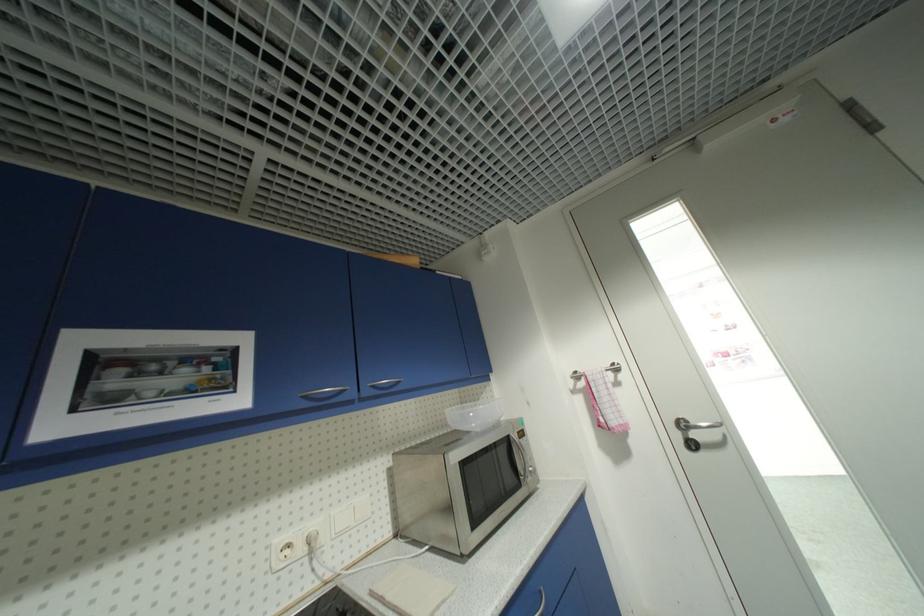
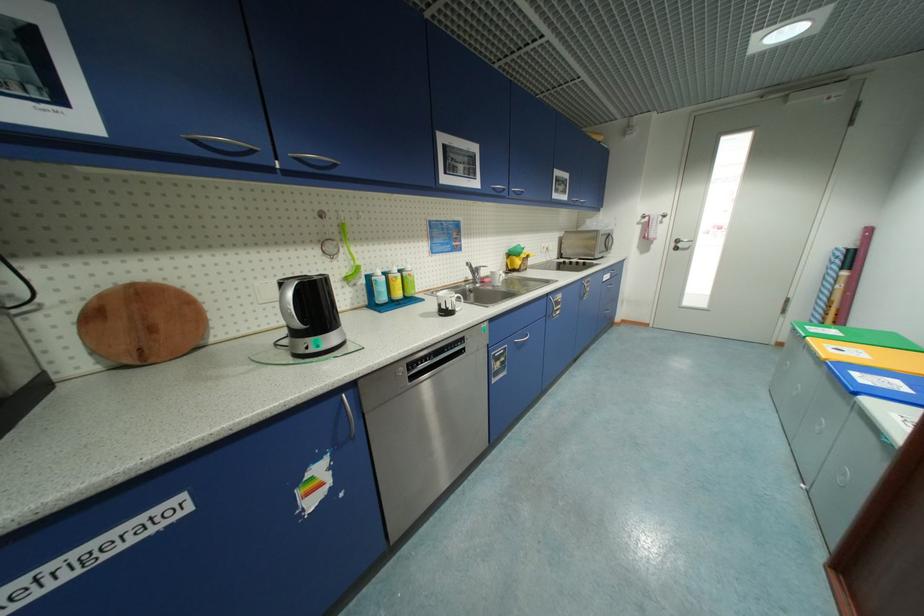
Locate, in the second image, the point that corresponds to [246,402] in the first image.

(570, 199)